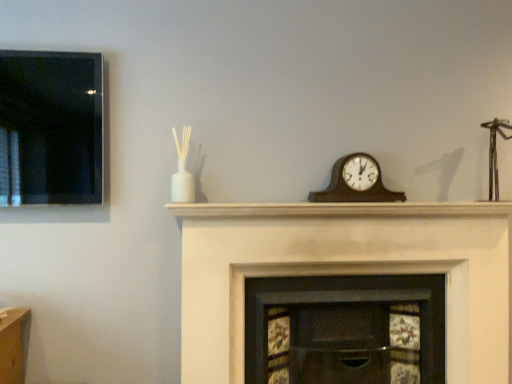
What do you see at coordinates (339, 209) in the screenshot? I see `white matte mantle at center` at bounding box center [339, 209].

Image resolution: width=512 pixels, height=384 pixels. What do you see at coordinates (345, 271) in the screenshot?
I see `white painted wood fireplace at center, positioned as the 1th fireplace in right-to-left order` at bounding box center [345, 271].

You are a GUI agent. You are given a task and a screenshot of the screen. Output one action in this format:
    pyautogui.click(x=<x>, y=<y>)
    Task: Click on the white matte mantle at center
    Image resolution: width=512 pixels, height=384 pixels.
    Given the screenshot: What is the action you would take?
    pyautogui.click(x=339, y=209)

Consider the image. Is wooden fireplace at center, which appears as the second fireplace when viewed from the right, taller or shorter than wooden clock at center?

In the image, wooden fireplace at center, which appears as the second fireplace when viewed from the right, appears to be taller than wooden clock at center.

From the image's perspective, which one is positioned higher, wooden fireplace at center, positioned as the first fireplace in left-to-right order, or wooden clock at center?

wooden clock at center, from the image's perspective.

Would you say wooden fireplace at center, which appears as the second fireplace when viewed from the right, is to the left or to the right of wooden clock at center in the picture?

From the image, it's evident that wooden fireplace at center, which appears as the second fireplace when viewed from the right, is to the left of wooden clock at center.

Which of these two, white painted wood fireplace at center, the 2th fireplace from the left, or white matte mantle at center, is thinner?

With smaller width is white matte mantle at center.

Considering the points (472, 316) and (434, 212), which point is behind, point (472, 316) or point (434, 212)?

Positioned behind is point (472, 316).

Is white painted wood fireplace at center, positioned as the 1th fireplace in right-to-left order, not near white matte mantle at center?

No, white painted wood fireplace at center, positioned as the 1th fireplace in right-to-left order, is not far from white matte mantle at center.

Considering the positions of objects wooden clock at center and white matte mantle at center in the image provided, who is more to the left, wooden clock at center or white matte mantle at center?

Positioned to the left is white matte mantle at center.

From the image's perspective, is wooden clock at center on top of white matte mantle at center?

Correct, wooden clock at center appears higher than white matte mantle at center in the image.

Is wooden clock at center turned away from white matte mantle at center?

No, white matte mantle at center is not at the back of wooden clock at center.

Find the location of a particular element. This screenshot has height=384, width=512. mantle in front of the wooden clock at center is located at coordinates (339, 209).

Is wooden fireplace at center, which appears as the second fireplace when viewed from the right, looking in the opposite direction of white matte mantle at center?

No, wooden fireplace at center, which appears as the second fireplace when viewed from the right, is not facing away from white matte mantle at center.

From a real-world perspective, is wooden fireplace at center, positioned as the first fireplace in left-to-right order, positioned above or below white matte mantle at center?

Clearly, from a real-world perspective, wooden fireplace at center, positioned as the first fireplace in left-to-right order, is below white matte mantle at center.

Does point (373, 320) lie in front of point (315, 207)?

No.

From a real-world perspective, which object stands above the other?

white painted wood fireplace at center, the 2th fireplace from the left, is physically above.

Does white painted wood fireplace at center, positioned as the 1th fireplace in right-to-left order, have a lesser width compared to wooden fireplace at center, positioned as the first fireplace in left-to-right order?

No.

Based on the photo, considering the positions of objects white painted wood fireplace at center, positioned as the 1th fireplace in right-to-left order, and wooden fireplace at center, which appears as the second fireplace when viewed from the right, in the image provided, who is in front, white painted wood fireplace at center, positioned as the 1th fireplace in right-to-left order, or wooden fireplace at center, which appears as the second fireplace when viewed from the right,?

white painted wood fireplace at center, positioned as the 1th fireplace in right-to-left order.

Is white painted wood fireplace at center, the 2th fireplace from the left, not close to wooden fireplace at center, positioned as the first fireplace in left-to-right order?

They are positioned close to each other.

From the image's perspective, is wooden clock at center above white painted wood fireplace at center, positioned as the 1th fireplace in right-to-left order?

Yes.

Does point (334, 197) come closer to viewer compared to point (436, 206)?

Yes.

Which of these two, wooden clock at center or white painted wood fireplace at center, positioned as the 1th fireplace in right-to-left order, is thinner?

With smaller width is wooden clock at center.

Find the location of a particular element. The width and height of the screenshot is (512, 384). mantle on the right of the white painted wood fireplace at center, the 2th fireplace from the left is located at coordinates (339, 209).

Does point (446, 207) come behind point (298, 218)?

That is True.

Between white matte mantle at center and white painted wood fireplace at center, the 2th fireplace from the left, which one appears on the left side from the viewer's perspective?

white painted wood fireplace at center, the 2th fireplace from the left.

How far apart are white matte mantle at center and white painted wood fireplace at center, the 2th fireplace from the left?

white matte mantle at center and white painted wood fireplace at center, the 2th fireplace from the left, are 18.36 centimeters apart from each other.

Identify the location of wall clock positioned vertically above the wooden fireplace at center, which appears as the second fireplace when viewed from the right (from a real-world perspective). The width and height of the screenshot is (512, 384). (356, 182).

Where is `fireplace that is the 1st object to the left of the white matte mantle at center, starting at the anchor`? fireplace that is the 1st object to the left of the white matte mantle at center, starting at the anchor is located at coordinates (345, 271).

Consider the image. Based on their spatial positions, is wooden clock at center or wooden fireplace at center, which appears as the second fireplace when viewed from the right, further from white painted wood fireplace at center, positioned as the 1th fireplace in right-to-left order?

wooden clock at center is further to white painted wood fireplace at center, positioned as the 1th fireplace in right-to-left order.

Which object lies nearer to the anchor point wooden fireplace at center, positioned as the first fireplace in left-to-right order, white matte mantle at center or white painted wood fireplace at center, positioned as the 1th fireplace in right-to-left order?

white painted wood fireplace at center, positioned as the 1th fireplace in right-to-left order.

Looking at the image, which one is located closer to white matte mantle at center, wooden clock at center or white painted wood fireplace at center, the 2th fireplace from the left?

Among the two, wooden clock at center is located nearer to white matte mantle at center.

Which object lies further to the anchor point white matte mantle at center, wooden fireplace at center, positioned as the first fireplace in left-to-right order, or white painted wood fireplace at center, positioned as the 1th fireplace in right-to-left order?

The object further to white matte mantle at center is wooden fireplace at center, positioned as the first fireplace in left-to-right order.

Estimate the real-world distances between objects in this image. Which object is closer to white matte mantle at center, white painted wood fireplace at center, positioned as the 1th fireplace in right-to-left order, or wooden clock at center?

Based on the image, wooden clock at center appears to be nearer to white matte mantle at center.

Which object lies nearer to the anchor point white painted wood fireplace at center, positioned as the 1th fireplace in right-to-left order, wooden clock at center or white matte mantle at center?

Based on the image, white matte mantle at center appears to be nearer to white painted wood fireplace at center, positioned as the 1th fireplace in right-to-left order.

Looking at the image, which one is located closer to white matte mantle at center, white painted wood fireplace at center, positioned as the 1th fireplace in right-to-left order, or wooden fireplace at center, positioned as the first fireplace in left-to-right order?

white painted wood fireplace at center, positioned as the 1th fireplace in right-to-left order.

Looking at the image, which one is located further to wooden clock at center, white painted wood fireplace at center, the 2th fireplace from the left, or wooden fireplace at center, positioned as the first fireplace in left-to-right order?

Among the two, wooden fireplace at center, positioned as the first fireplace in left-to-right order, is located further to wooden clock at center.

Find the location of a particular element. This screenshot has height=384, width=512. mantle between wooden clock at center and white painted wood fireplace at center, positioned as the 1th fireplace in right-to-left order, in the up-down direction is located at coordinates (339, 209).

Identify the location of fireplace between white matte mantle at center and wooden fireplace at center, positioned as the first fireplace in left-to-right order, in the vertical direction. (345, 271).

Identify the location of mantle between wooden clock at center and wooden fireplace at center, which appears as the second fireplace when viewed from the right, vertically. The width and height of the screenshot is (512, 384). (339, 209).

Where is `fireplace between wooden clock at center and wooden fireplace at center, positioned as the first fireplace in left-to-right order, in the vertical direction`? fireplace between wooden clock at center and wooden fireplace at center, positioned as the first fireplace in left-to-right order, in the vertical direction is located at coordinates coord(345,271).